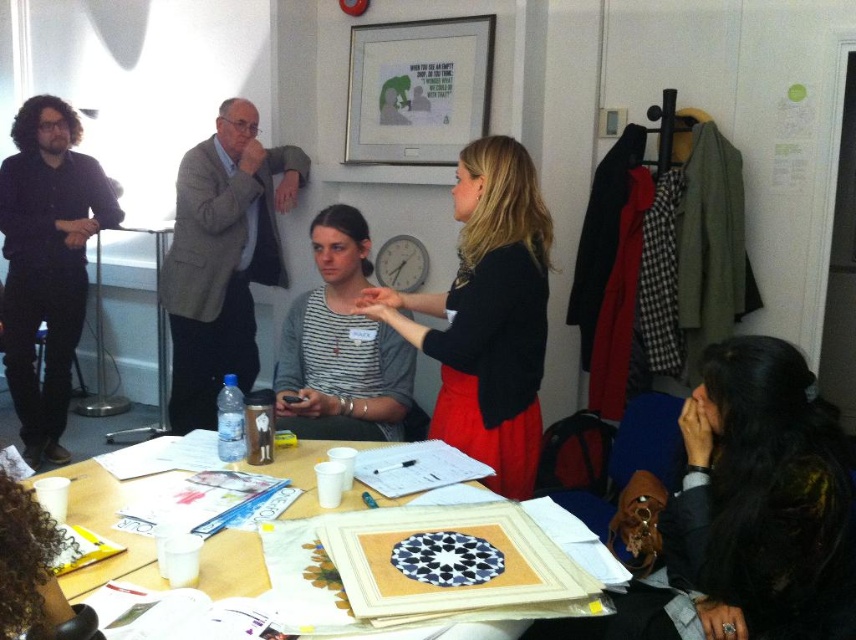
You are a photographer standing at the back of the room. You want to take a photo that includes both the striped fabric shirt at center and the matte silver picture frame at upper center. Which object will appear larger in the photo?

The striped fabric shirt at center will appear larger in the photo because it has a greater height compared to the matte silver picture frame at upper center.

You are standing at the entrance of the room and want to look at the matte silver picture frame at upper center. Which direction should you turn to see it from the wooden table at center?

The matte silver picture frame at upper center is to the right of the wooden table at center, so you should turn to your right to see it from the wooden table at center.